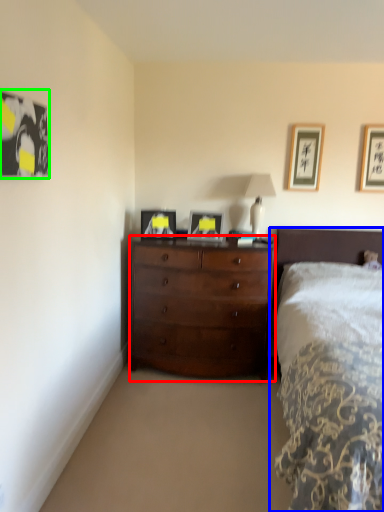
Question: Estimate the real-world distances between objects in this image. Which object is closer to chest of drawers (highlighted by a red box), bed (highlighted by a blue box) or picture frame (highlighted by a green box)?

Choices:
 (A) bed
 (B) picture frame

Answer: (A)